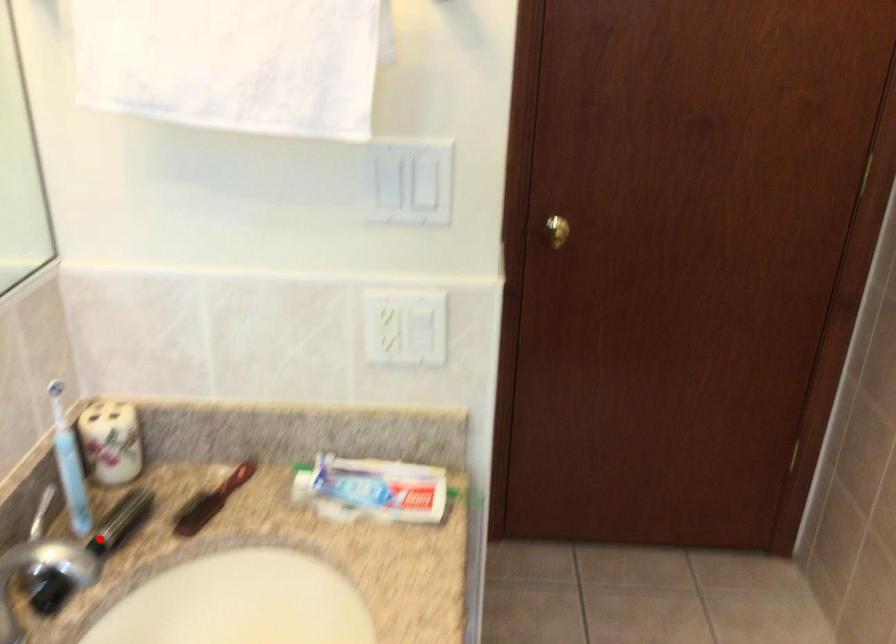
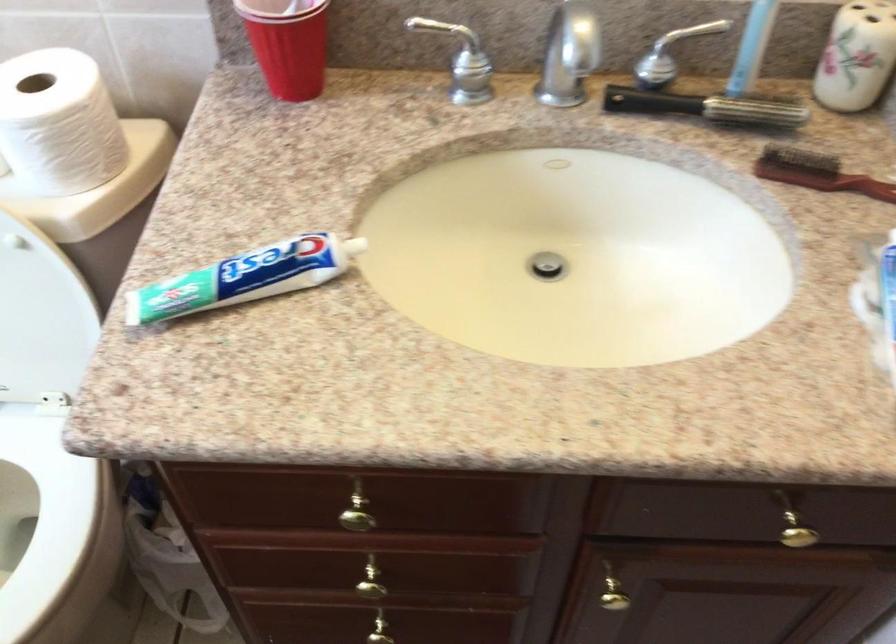
The point at the highlighted location is marked in the first image. Where is the corresponding point in the second image?

(707, 107)